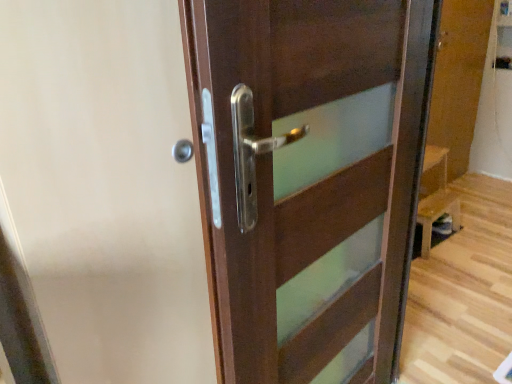
Question: Based on their positions, is dark wood door at center located to the left or right of matte wood screen door at center?

Choices:
 (A) left
 (B) right

Answer: (B)

Question: In terms of width, does dark wood door at center look wider or thinner when compared to matte wood screen door at center?

Choices:
 (A) wide
 (B) thin

Answer: (A)

Question: Is dark wood door at center taller or shorter than matte wood screen door at center?

Choices:
 (A) short
 (B) tall

Answer: (A)

Question: In terms of size, does matte wood screen door at center appear bigger or smaller than dark wood door at center?

Choices:
 (A) small
 (B) big

Answer: (B)

Question: From a real-world perspective, is matte wood screen door at center positioned above or below dark wood door at center?

Choices:
 (A) below
 (B) above

Answer: (B)

Question: Is matte wood screen door at center to the left or to the right of dark wood door at center in the image?

Choices:
 (A) right
 (B) left

Answer: (B)

Question: Would you say matte wood screen door at center is inside or outside dark wood door at center?

Choices:
 (A) inside
 (B) outside

Answer: (B)